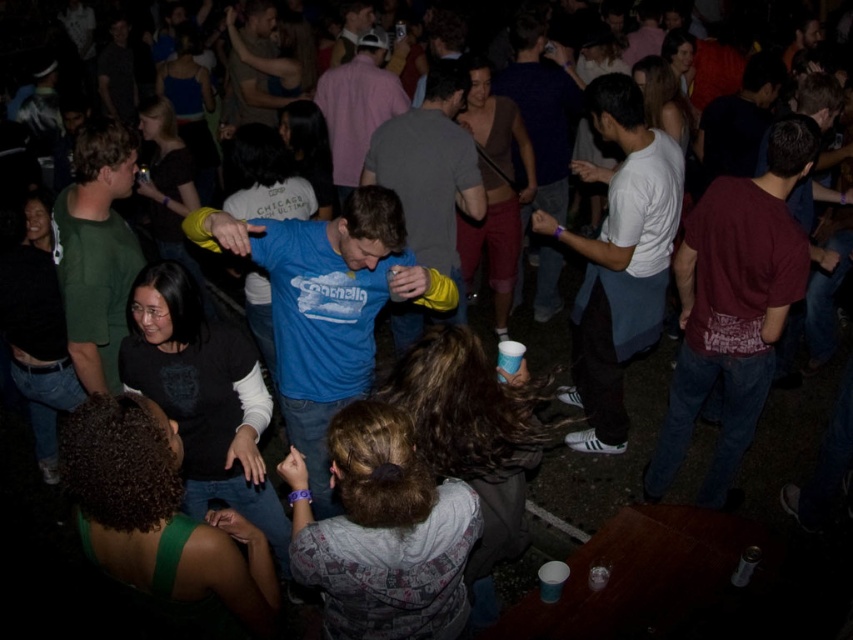
You are standing at the entrance of the event and want to reach the bar located at point [427,113]. There is a person at point [392,204] blocking your path. Can you walk around them to reach the bar?

Point [392,204] is in front of point [427,113]. Since the person is blocking your path, you would need to go around them either to the left or right to reach the bar at point [427,113].